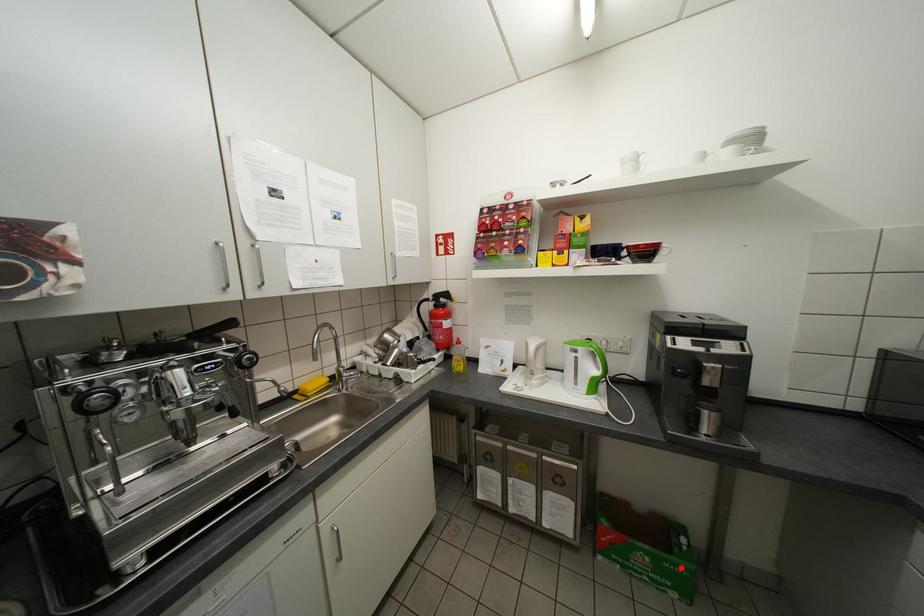
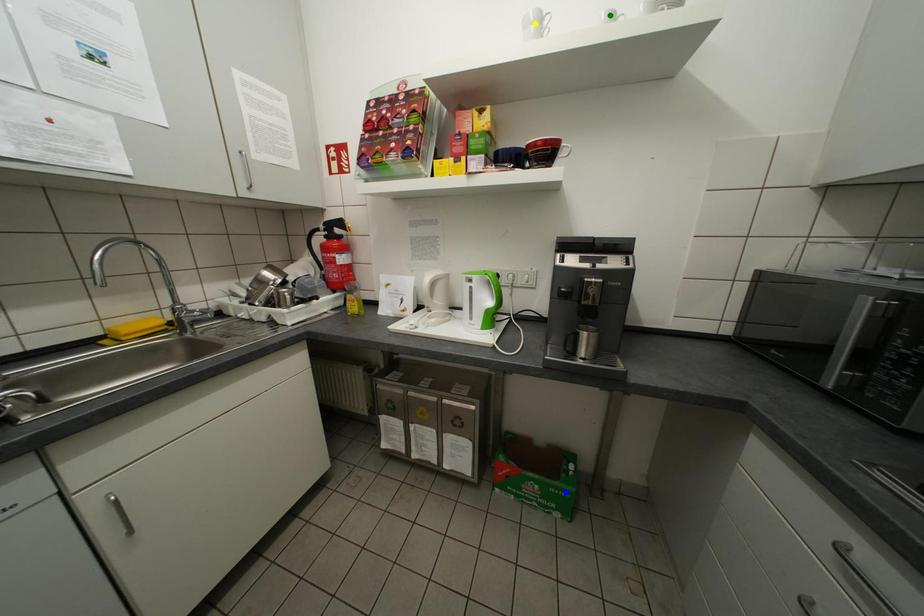
Question: I am providing you with two images of the same scene from different viewpoints. A red point is marked on the first image. You are given multiple points on the second image. Can you choose the point in image 2 that corresponds to the point in image 1?

Choices:
 (A) green point
 (B) blue point
 (C) yellow point

Answer: (B)